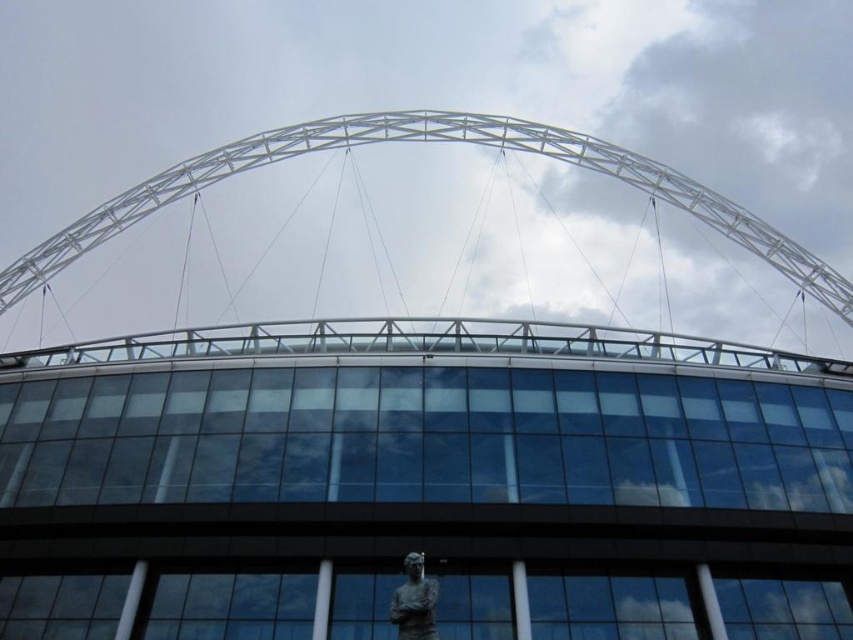
Question: From the image, what is the correct spatial relationship of white metallic arch at center in relation to bronze statue at lower center?

Choices:
 (A) below
 (B) above

Answer: (B)

Question: Is white metallic arch at center wider than bronze statue at lower center?

Choices:
 (A) yes
 (B) no

Answer: (A)

Question: Is white metallic arch at center positioned behind bronze statue at lower center?

Choices:
 (A) yes
 (B) no

Answer: (A)

Question: Which point is farther to the camera?

Choices:
 (A) (424, 608)
 (B) (833, 280)

Answer: (B)